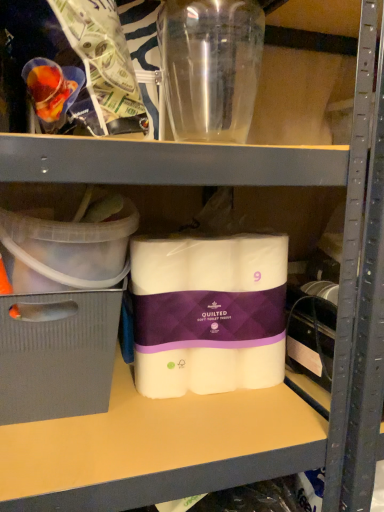
Question: Is transparent plastic bottle at upper center situated inside gray cardboard box at left, which is counted as the 1th storage box, starting from the bottom, or outside?

Choices:
 (A) outside
 (B) inside

Answer: (A)

Question: In the image, is transparent plastic bottle at upper center on the left side or the right side of gray cardboard box at left, the 2th storage box viewed from the top?

Choices:
 (A) right
 (B) left

Answer: (A)

Question: Which object is positioned farthest from the white quilted toilet paper at center?

Choices:
 (A) gray cardboard box at left, the 2th storage box viewed from the top
 (B) clear plastic container at left, the 2th storage box positioned from the bottom
 (C) transparent plastic bottle at upper center

Answer: (C)

Question: Estimate the real-world distances between objects in this image. Which object is closer to the white quilted toilet paper at center?

Choices:
 (A) transparent plastic bottle at upper center
 (B) clear plastic container at left, the 2th storage box positioned from the bottom
 (C) gray cardboard box at left, the 2th storage box viewed from the top

Answer: (C)